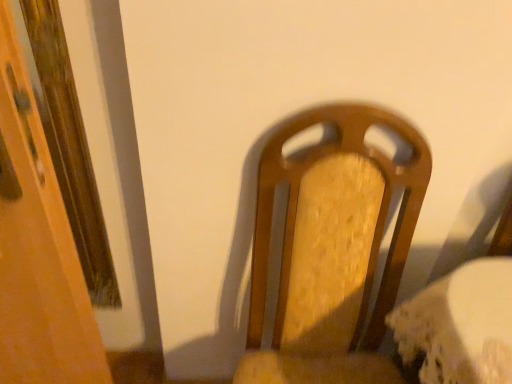
Locate an element on the screen. The image size is (512, 384). wooden chair at center is located at coordinates (332, 249).

Image resolution: width=512 pixels, height=384 pixels. Describe the element at coordinates (332, 249) in the screenshot. I see `wooden chair at center` at that location.

You are a GUI agent. You are given a task and a screenshot of the screen. Output one action in this format:
    pyautogui.click(x=<x>, y=<y>)
    Task: Click on the wooden chair at center
    The width and height of the screenshot is (512, 384).
    Given the screenshot: What is the action you would take?
    pyautogui.click(x=332, y=249)